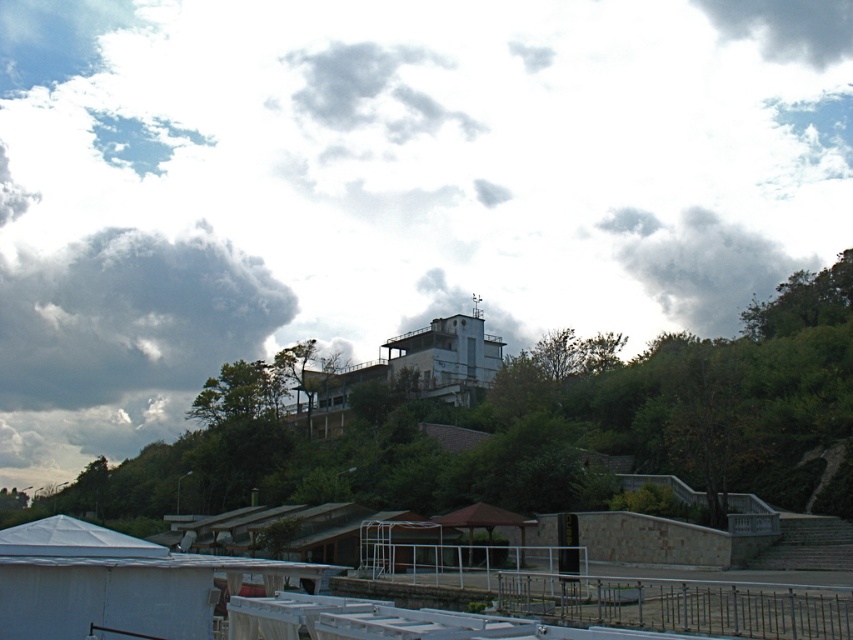
Question: Among these points, which one is farthest from the camera?

Choices:
 (A) click(233, 321)
 (B) click(755, 28)
 (C) click(646, 284)

Answer: (B)

Question: In this image, where is dark gray fluffy cloud at upper left located relative to dark gray cloud at upper right?

Choices:
 (A) above
 (B) below

Answer: (B)

Question: Among these points, which one is farthest from the camera?

Choices:
 (A) (735, 225)
 (B) (4, 332)

Answer: (B)

Question: Is gray fluffy cloud at upper right positioned at the back of dark gray cloud at upper right?

Choices:
 (A) yes
 (B) no

Answer: (B)

Question: In this image, where is dark gray fluffy cloud at upper left located relative to gray fluffy cloud at upper right?

Choices:
 (A) below
 (B) above

Answer: (A)

Question: Which of the following is the farthest from the observer?

Choices:
 (A) (761, 285)
 (B) (811, 33)

Answer: (B)